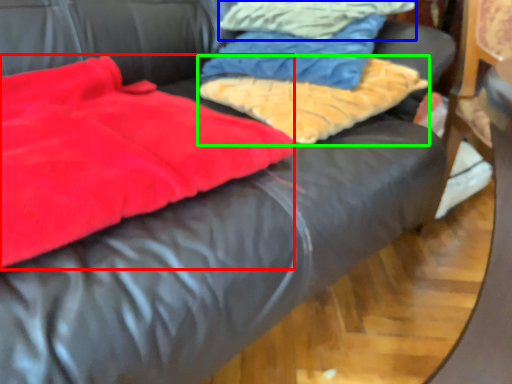
Question: Which object is the closest to the blanket (highlighted by a red box)? Choose among these: cloth (highlighted by a blue box) or cloth (highlighted by a green box).

Choices:
 (A) cloth
 (B) cloth

Answer: (B)